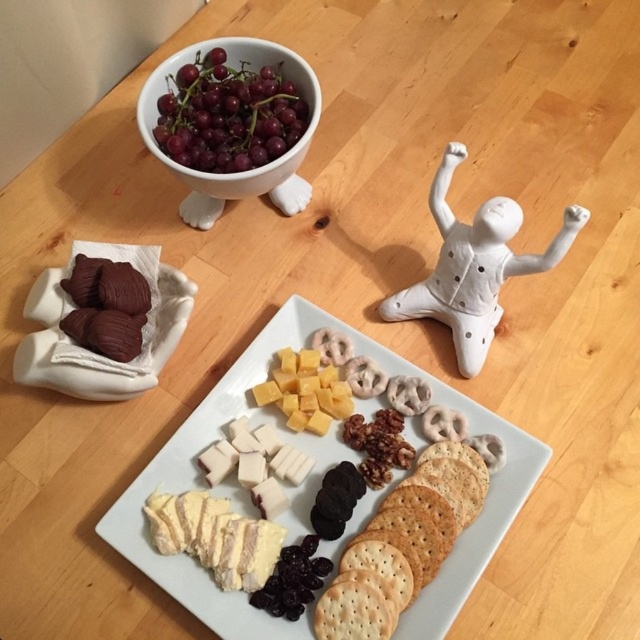
Which of these two, sliced cheese at center or white matte figurine at upper right, stands taller?

sliced cheese at center

Between point (232, 493) and point (472, 355), which one is positioned in front?

Positioned in front is point (232, 493).

Does point (276, 636) come farther from viewer compared to point (513, 227)?

No, it is not.

Locate an element on the screen. The width and height of the screenshot is (640, 640). sliced cheese at center is located at coordinates (276, 426).

Which is behind, point (515, 209) or point (72, 326)?

The point (72, 326) is behind.

Is point (474, 220) in front of point (124, 300)?

No.

The width and height of the screenshot is (640, 640). I want to click on white matte figurine at upper right, so click(x=474, y=266).

Based on the photo, who is positioned more to the left, purple grapes at upper left or matte chocolate truffles at upper left?

Positioned to the left is matte chocolate truffles at upper left.

Which is below, purple grapes at upper left or matte chocolate truffles at upper left?

matte chocolate truffles at upper left

Which is in front, point (202, 84) or point (100, 289)?

Positioned in front is point (100, 289).

Where is `purple grapes at upper left`? Image resolution: width=640 pixels, height=640 pixels. purple grapes at upper left is located at coordinates (228, 115).